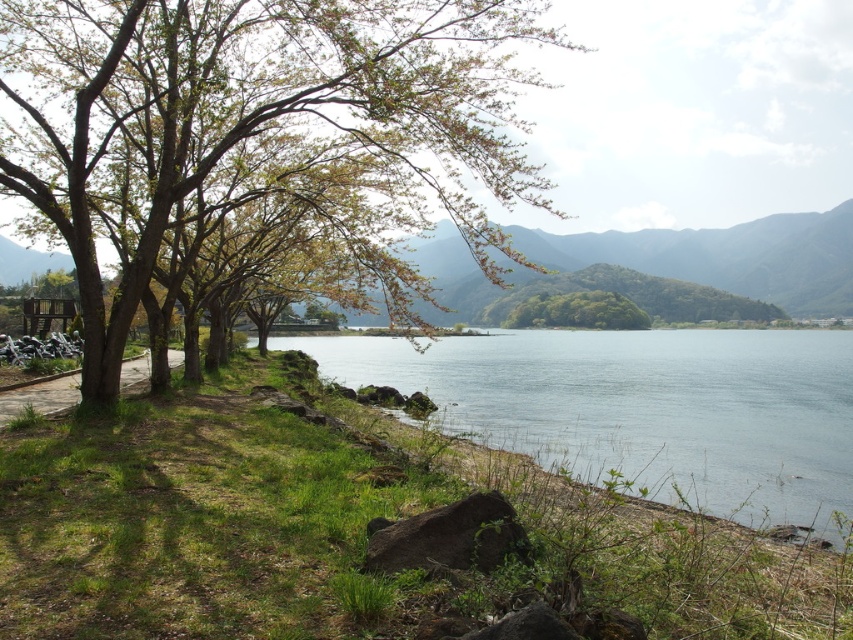
Question: Is smooth bark tree at left bigger than green leafy hill at center?

Choices:
 (A) yes
 (B) no

Answer: (A)

Question: Which point is closer to the camera?

Choices:
 (A) smooth bark tree at left
 (B) green leafy hill at center
 (C) clear water at lower center

Answer: (A)

Question: Which object is farther from the camera taking this photo?

Choices:
 (A) smooth bark tree at left
 (B) clear water at lower center

Answer: (B)

Question: Estimate the real-world distances between objects in this image. Which object is closer to the green leafy hill at center?

Choices:
 (A) smooth bark tree at left
 (B) clear water at lower center

Answer: (B)

Question: Is the position of clear water at lower center less distant than that of green leafy hill at center?

Choices:
 (A) yes
 (B) no

Answer: (A)

Question: Is clear water at lower center thinner than green leafy hill at center?

Choices:
 (A) no
 (B) yes

Answer: (A)